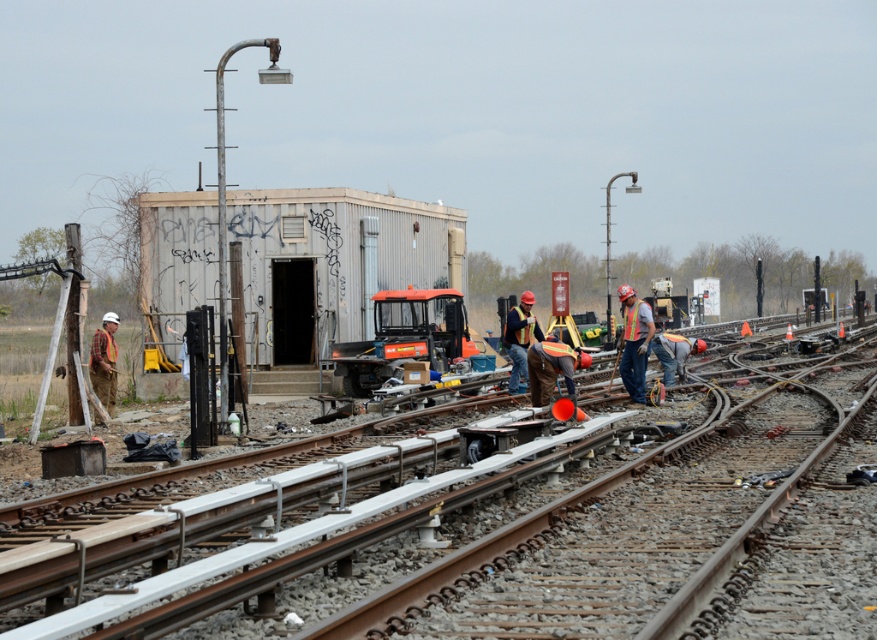
You are a railway worker standing at the point with coordinates (404, 337) in the image. You need to move to the small weathered building with graffiti on the left. Which direction should you walk to reach it?

The point at (404, 337) corresponds to the orange plastic tractor at center. To reach the small weathered building with graffiti on the left, you should walk to the left.

You are standing at the point with coordinates point (647, 317) and want to walk to the point with coordinates point (450, 332). Which direction should you move in relation to the lamppost next to the weathered building?

You should move towards the point (450, 332), which is behind point (647, 317). Since the lamppost is next to the weathered building on the left side of the image, moving behind point (647, 317) would mean moving towards the right and slightly downward relative to the lamppost.